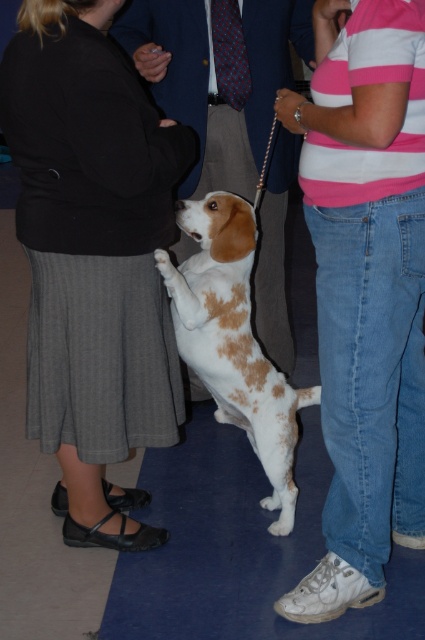
You are trying to decide whether to place a new decorative item on the matte black jacket at center or the white fur dog at center. Based on their sizes, which object would allow the decorative item to be more visible?

The white fur dog at center has a greater width than the matte black jacket at center, so placing the decorative item on the white fur dog at center would make it more visible due to its larger size.

You are standing at point (254, 304) and want to walk to point (105, 499). Is the path between these two points clear?

Yes, the path between point (105, 499) and point (254, 304) is clear because point (105, 499) is in front of point (254, 304), indicating no obstruction.

You are a photographer trying to capture a group photo. You notice the pink striped shirt at upper right and the spotted fur dog at center. Which object should you adjust to ensure both are in frame? Please explain your reasoning.

The pink striped shirt at upper right has a larger size compared to the spotted fur dog at center. Since the shirt is larger, it might already be more visible, so you should adjust the spotted fur dog at center to ensure it is fully in frame.